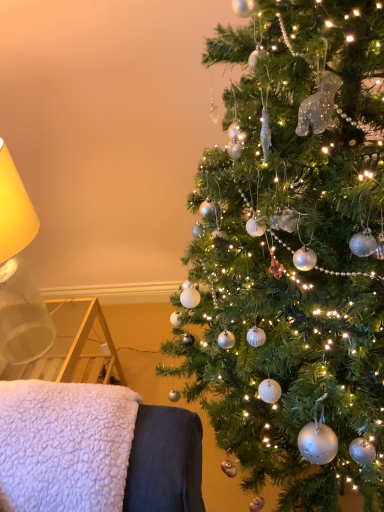
This screenshot has height=512, width=384. Describe the element at coordinates (294, 254) in the screenshot. I see `shiny silver ornaments at right` at that location.

Where is `white fluffy blanket at lower left`? Image resolution: width=384 pixels, height=512 pixels. white fluffy blanket at lower left is located at coordinates (65, 445).

Identify the location of translucent glass lampshade at left. This screenshot has width=384, height=512. (19, 273).

I want to click on shiny silver ornaments at right, so click(294, 254).

Between shiny silver ornaments at right and translucent glass lampshade at left, which one has less height?

Standing shorter between the two is translucent glass lampshade at left.

This screenshot has width=384, height=512. What are the coordinates of `table lamp above the shiny silver ornaments at right (from the image's perspective)` in the screenshot? It's located at click(x=19, y=273).

Is shiny silver ornaments at right inside the boundaries of translucent glass lampshade at left, or outside?

shiny silver ornaments at right is not inside translucent glass lampshade at left, it's outside.

Who is smaller, shiny silver ornaments at right or translucent glass lampshade at left?

translucent glass lampshade at left is smaller.

Based on the photo, from the image's perspective, which object appears higher, translucent glass lampshade at left or white fluffy blanket at lower left?

translucent glass lampshade at left.

Looking at their sizes, would you say translucent glass lampshade at left is wider or thinner than white fluffy blanket at lower left?

In the image, translucent glass lampshade at left appears to be more narrow than white fluffy blanket at lower left.

How much distance is there between translucent glass lampshade at left and white fluffy blanket at lower left?

translucent glass lampshade at left and white fluffy blanket at lower left are 29.45 inches apart.

Considering the points (28, 333) and (24, 490), which point is behind, point (28, 333) or point (24, 490)?

Point (28, 333)

Identify the location of christmas tree above the white fluffy blanket at lower left (from a real-world perspective). (294, 254).

Are shiny silver ornaments at right and white fluffy blanket at lower left located far from each other?

They are positioned close to each other.

Is the depth of shiny silver ornaments at right less than that of white fluffy blanket at lower left?

Yes, shiny silver ornaments at right is closer to the camera.

Does point (271, 305) lie behind point (82, 508)?

Yes, point (271, 305) is behind point (82, 508).

Is white fluffy blanket at lower left far away from shiny silver ornaments at right?

They are positioned close to each other.

From the image's perspective, is white fluffy blanket at lower left on top of shiny silver ornaments at right?

No, from the image's perspective, white fluffy blanket at lower left is not above shiny silver ornaments at right.

Is point (86, 418) closer to camera compared to point (358, 360)?

Yes, point (86, 418) is in front of point (358, 360).

Can you confirm if white fluffy blanket at lower left is shorter than shiny silver ornaments at right?

Yes, white fluffy blanket at lower left is shorter than shiny silver ornaments at right.

Does point (19, 218) lie in front of point (367, 263)?

No, (19, 218) is behind (367, 263).

From the image's perspective, is translucent glass lampshade at left positioned above or below shiny silver ornaments at right?

translucent glass lampshade at left is above shiny silver ornaments at right.

Identify the location of table lamp above the shiny silver ornaments at right (from a real-world perspective). Image resolution: width=384 pixels, height=512 pixels. (19, 273).

Is translucent glass lampshade at left turned away from shiny silver ornaments at right?

No, translucent glass lampshade at left's orientation is not away from shiny silver ornaments at right.

From a real-world perspective, is white fluffy blanket at lower left physically above translucent glass lampshade at left?

No, from a real-world perspective, white fluffy blanket at lower left is not above translucent glass lampshade at left.

Image resolution: width=384 pixels, height=512 pixels. What are the coordinates of `blanket lying on the right of translucent glass lampshade at left` in the screenshot? It's located at (65, 445).

Looking at this image, is white fluffy blanket at lower left positioned with its back to translucent glass lampshade at left?

No, white fluffy blanket at lower left is not facing the opposite direction of translucent glass lampshade at left.

Is white fluffy blanket at lower left not within translucent glass lampshade at left?

white fluffy blanket at lower left lies outside translucent glass lampshade at left's area.

You are a GUI agent. You are given a task and a screenshot of the screen. Output one action in this format:
    pyautogui.click(x=<x>, y=<y>)
    Task: Click on the christmas tree that appears below the translucent glass lampshade at left (from a real-world perspective)
    This screenshot has height=512, width=384.
    Given the screenshot: What is the action you would take?
    pyautogui.click(x=294, y=254)

The width and height of the screenshot is (384, 512). Identify the location of blanket located in front of the translucent glass lampshade at left. (65, 445).

Considering their positions, is white fluffy blanket at lower left positioned further to translucent glass lampshade at left than shiny silver ornaments at right?

shiny silver ornaments at right.

Which object lies nearer to the anchor point shiny silver ornaments at right, translucent glass lampshade at left or white fluffy blanket at lower left?

white fluffy blanket at lower left is closer to shiny silver ornaments at right.

From the image, which object appears to be farther from shiny silver ornaments at right, white fluffy blanket at lower left or translucent glass lampshade at left?

translucent glass lampshade at left.

When comparing their distances from translucent glass lampshade at left, does shiny silver ornaments at right or white fluffy blanket at lower left seem closer?

Result: white fluffy blanket at lower left is positioned closer to the anchor translucent glass lampshade at left.

Which object lies nearer to the anchor point white fluffy blanket at lower left, shiny silver ornaments at right or translucent glass lampshade at left?

shiny silver ornaments at right is closer to white fluffy blanket at lower left.

Which object lies further to the anchor point white fluffy blanket at lower left, translucent glass lampshade at left or shiny silver ornaments at right?

translucent glass lampshade at left.

Locate an element on the screen. Image resolution: width=384 pixels, height=512 pixels. blanket between translucent glass lampshade at left and shiny silver ornaments at right from left to right is located at coordinates (65, 445).